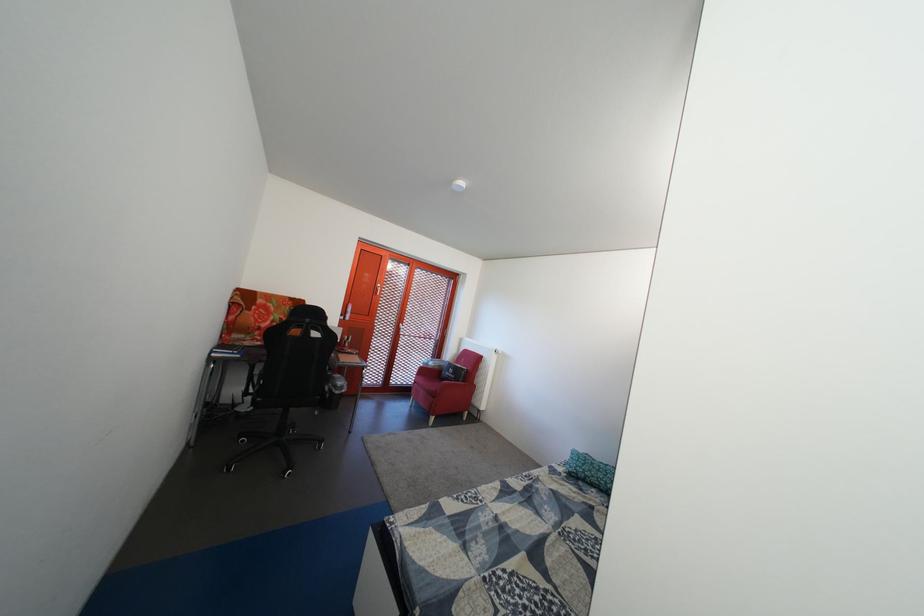
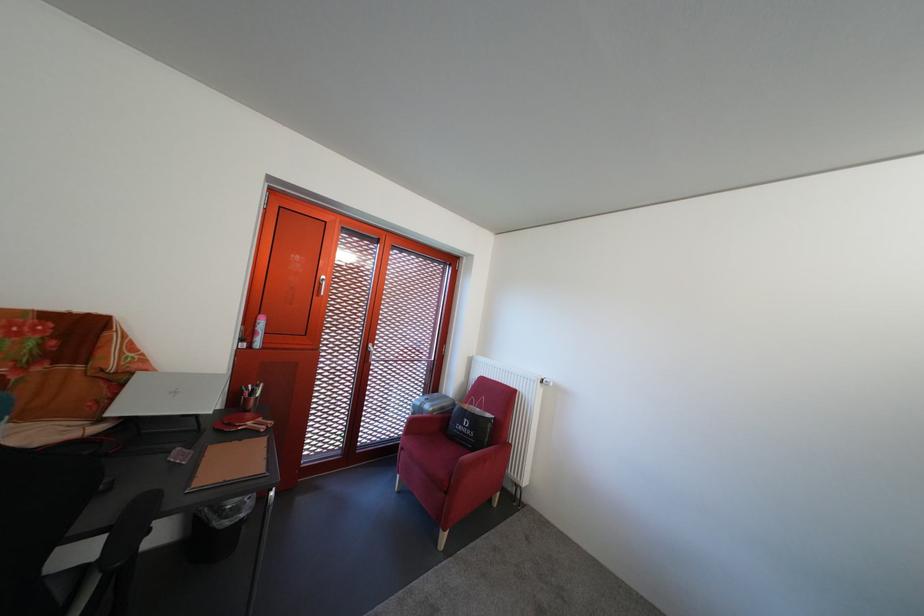
Where in the second image is the point corresponding to [348,399] from the first image?

(237, 530)